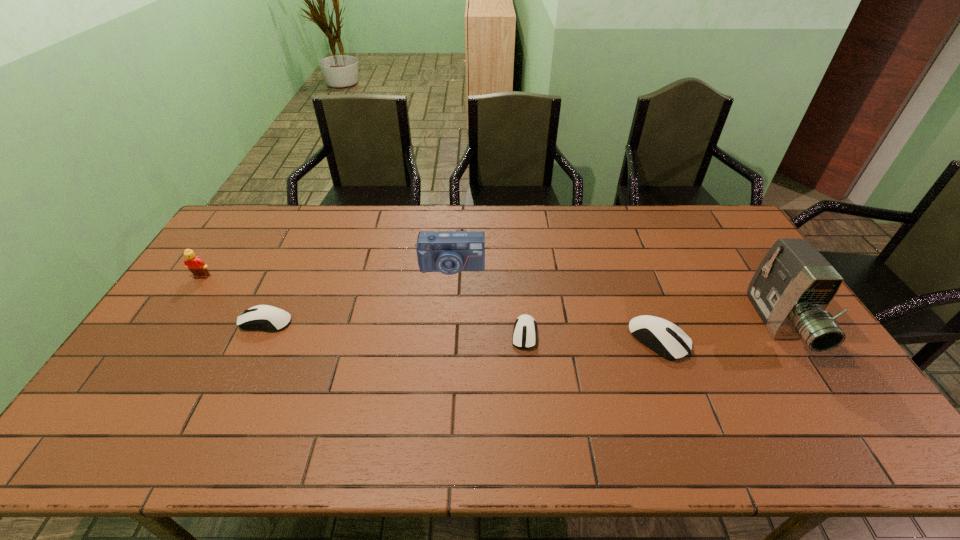
The height and width of the screenshot is (540, 960). Find the location of `vacant space located 0.070m on the back of the leftmost mouse`. vacant space located 0.070m on the back of the leftmost mouse is located at coordinates (278, 294).

Locate an element on the screen. vacant space located 0.230m on the right of the shortest object is located at coordinates (618, 334).

Locate an element on the screen. vacant space positioned on the back of the fifth object from left to right is located at coordinates (638, 287).

The image size is (960, 540). Find the location of `vacant space located on the face of the Lego`. vacant space located on the face of the Lego is located at coordinates (190, 295).

Locate an element on the screen. Image resolution: width=960 pixels, height=540 pixels. free location located on the lens of the camera is located at coordinates (445, 345).

Locate an element on the screen. The image size is (960, 540). vacant space located 0.140m at the front of the tallest object, highlighting the lens is located at coordinates (835, 412).

What are the coordinates of `object that is at the left edge` in the screenshot? It's located at (197, 266).

Find the location of a particular element. object present at the right edge is located at coordinates (x=793, y=285).

Where is `vacant space at the far edge of the desktop`? The image size is (960, 540). vacant space at the far edge of the desktop is located at coordinates (367, 228).

Locate an element on the screen. Image resolution: width=960 pixels, height=540 pixels. vacant space at the right edge of the desktop is located at coordinates (738, 301).